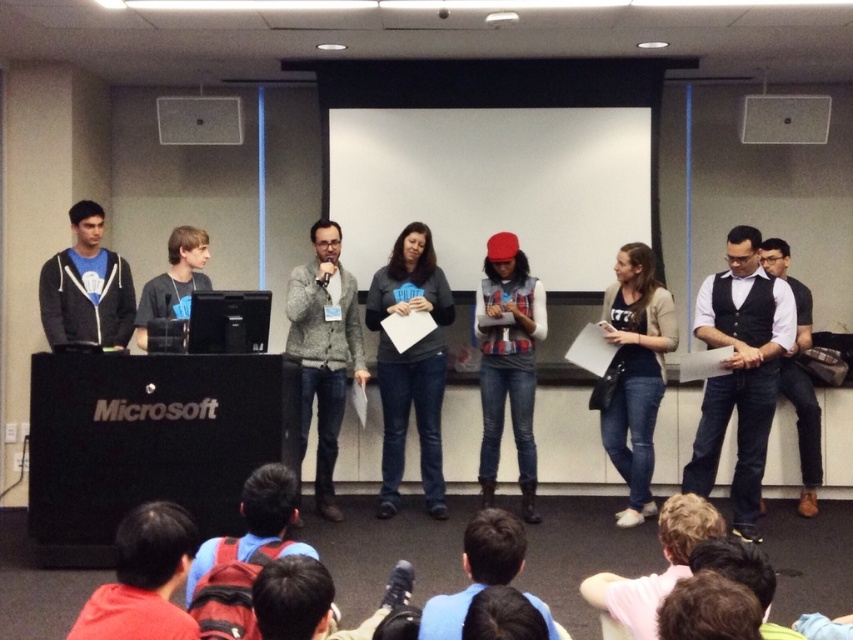
Can you confirm if white matte projection screen at center is bigger than denim vest at center?

Yes, white matte projection screen at center is bigger than denim vest at center.

Can you confirm if white matte projection screen at center is positioned to the right of denim vest at center?

No, white matte projection screen at center is not to the right of denim vest at center.

Where is `white matte projection screen at center`? This screenshot has width=853, height=640. white matte projection screen at center is located at coordinates (492, 186).

I want to click on white matte projection screen at center, so click(492, 186).

Does point (329, 417) come in front of point (798, 134)?

Yes, it is in front of point (798, 134).

Does knitted sweater at center have a greater height compared to matte black laptop at upper center?

Yes, knitted sweater at center is taller than matte black laptop at upper center.

Who is more distant from viewer, (296, 284) or (799, 120)?

The point (799, 120) is behind.

At what (x,y) coordinates should I click in order to perform the action: click on knitted sweater at center. Please return your answer as a coordinate pair (x, y). This screenshot has height=640, width=853. Looking at the image, I should click on (323, 349).

Between white matte vest at center and matte black hoodie at left, which one has less height?

Standing shorter between the two is matte black hoodie at left.

Between white matte vest at center and matte black hoodie at left, which one is positioned higher?

matte black hoodie at left is above.

Identify the location of white matte vest at center. (740, 372).